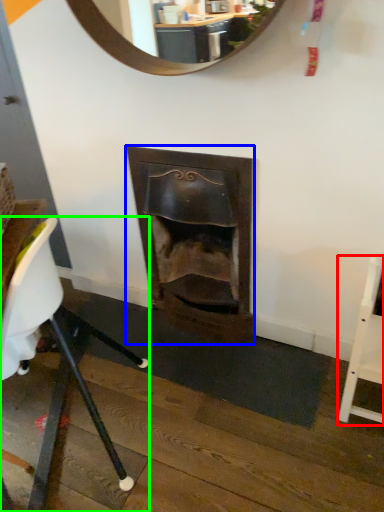
Question: Which is nearer to the chair (highlighted by a red box)? fireplace (highlighted by a blue box) or chair (highlighted by a green box).

Choices:
 (A) fireplace
 (B) chair

Answer: (A)